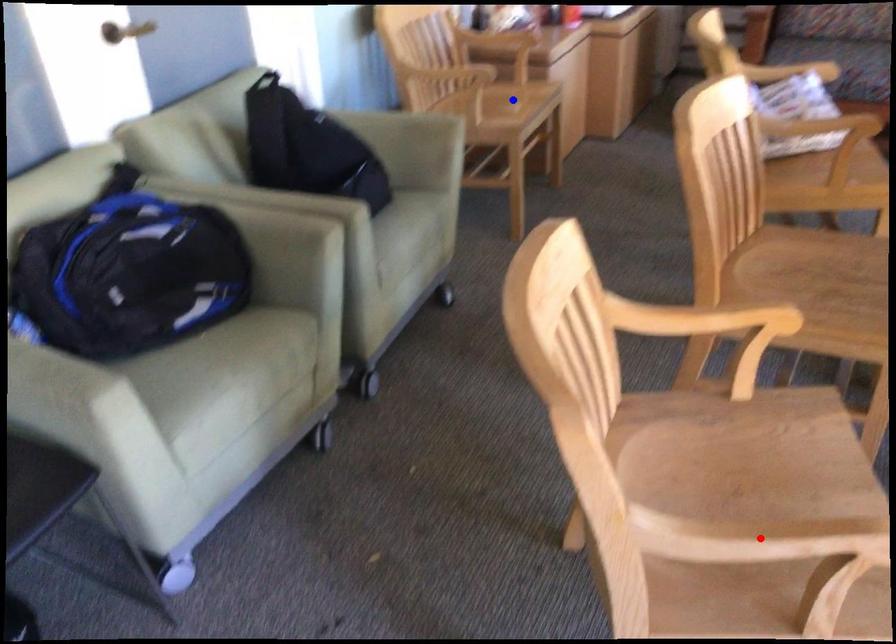
Question: In the image, two points are highlighted. Which point is nearer to the camera? Reply with the corresponding letter.

Choices:
 (A) blue point
 (B) red point

Answer: (B)